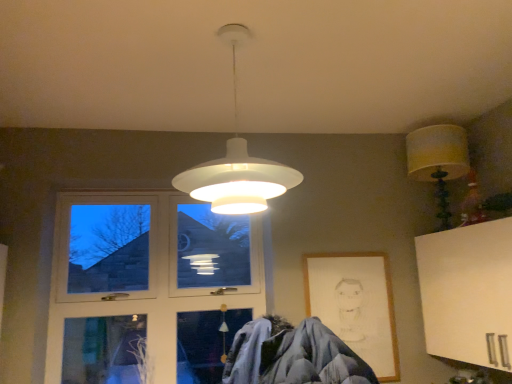
Question: Is wooden picture frame at lower right to the right of clear glass window at left from the viewer's perspective?

Choices:
 (A) yes
 (B) no

Answer: (A)

Question: From the image's perspective, would you say wooden picture frame at lower right is positioned over clear glass window at left?

Choices:
 (A) no
 (B) yes

Answer: (A)

Question: Does wooden picture frame at lower right turn towards clear glass window at left?

Choices:
 (A) yes
 (B) no

Answer: (B)

Question: Is wooden picture frame at lower right thinner than clear glass window at left?

Choices:
 (A) yes
 (B) no

Answer: (A)

Question: Does wooden picture frame at lower right lie behind clear glass window at left?

Choices:
 (A) yes
 (B) no

Answer: (B)

Question: From the image's perspective, is clear glass window at left located above or below white matte pendant light at center, placed as the second lamp when sorted from right to left?

Choices:
 (A) below
 (B) above

Answer: (A)

Question: Is clear glass window at left to the left or to the right of white matte pendant light at center, which is the 2th lamp in back-to-front order, in the image?

Choices:
 (A) right
 (B) left

Answer: (B)

Question: From their relative heights in the image, would you say clear glass window at left is taller or shorter than white matte pendant light at center, which is the 2th lamp in back-to-front order?

Choices:
 (A) tall
 (B) short

Answer: (A)

Question: Is clear glass window at left inside or outside of white matte pendant light at center, which is the 2th lamp in back-to-front order?

Choices:
 (A) inside
 (B) outside

Answer: (B)

Question: Based on their sizes in the image, would you say clear glass window at left is bigger or smaller than yellow fabric lampshade at upper right, the 1th lamp positioned from the back?

Choices:
 (A) small
 (B) big

Answer: (B)

Question: From a real-world perspective, is clear glass window at left physically located above or below yellow fabric lampshade at upper right, the 1th lamp positioned from the back?

Choices:
 (A) below
 (B) above

Answer: (A)

Question: Which is correct: clear glass window at left is inside yellow fabric lampshade at upper right, the 1th lamp positioned from the back, or outside of it?

Choices:
 (A) inside
 (B) outside

Answer: (B)

Question: Does point (66, 241) appear closer or farther from the camera than point (466, 147)?

Choices:
 (A) closer
 (B) farther

Answer: (A)

Question: From the image's perspective, is clear glass window at left located above or below wooden picture frame at lower right?

Choices:
 (A) above
 (B) below

Answer: (A)

Question: Visually, is clear glass window at left positioned to the left or to the right of wooden picture frame at lower right?

Choices:
 (A) right
 (B) left

Answer: (B)